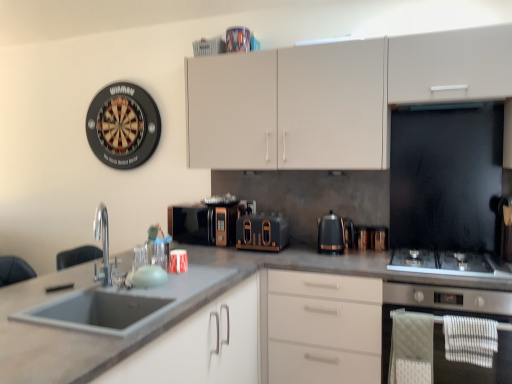
How much space does metallic silver kettle at center, which is the first appliance from right to left, occupy horizontally?

It is 3.14 inches.

Locate an element on the screen. black metallic kettle at center is located at coordinates [333, 233].

What is the approximate width of polished chrome faucet at sink left?

polished chrome faucet at sink left is 10.65 inches wide.

You are a GUI agent. You are given a task and a screenshot of the screen. Output one action in this format:
    pyautogui.click(x=<x>, y=<y>)
    Task: Click on the matte black coffee machine at center
    The image size is (512, 384).
    Given the screenshot: What is the action you would take?
    pyautogui.click(x=203, y=223)

Is gray matte countertop at center turned away from matte white cabinets at upper center, placed as the second cabinetry when sorted from left to right?

No, gray matte countertop at center is not facing the opposite direction of matte white cabinets at upper center, placed as the second cabinetry when sorted from left to right.

Consider the image. From a real-world perspective, is gray matte countertop at center positioned over matte white cabinets at upper center, arranged as the second cabinetry when ordered from the bottom, based on gravity?

Incorrect, from a real-world perspective, gray matte countertop at center is lower than matte white cabinets at upper center, arranged as the second cabinetry when ordered from the bottom.

Considering the sizes of objects gray matte countertop at center and matte white cabinets at upper center, placed as the second cabinetry when sorted from left to right, in the image provided, who is smaller, gray matte countertop at center or matte white cabinets at upper center, placed as the second cabinetry when sorted from left to right,?

With smaller size is matte white cabinets at upper center, placed as the second cabinetry when sorted from left to right.

Are gray matte countertop at center and matte white cabinets at upper center, which is counted as the 1th cabinetry, starting from the right, making contact?

No, gray matte countertop at center is not touching matte white cabinets at upper center, which is counted as the 1th cabinetry, starting from the right.

Is black metallic kettle at center located within matte black toaster at center, the 1th appliance viewed from the left?

Actually, black metallic kettle at center is outside matte black toaster at center, the 1th appliance viewed from the left.

Considering the sizes of objects matte black toaster at center, marked as the second appliance in a right-to-left arrangement, and black metallic kettle at center in the image provided, who is taller, matte black toaster at center, marked as the second appliance in a right-to-left arrangement, or black metallic kettle at center?

Standing taller between the two is black metallic kettle at center.

From a real-world perspective, who is located lower, black metallic kettle at center or matte white cabinets at upper center, which is counted as the 1th cabinetry, starting from the right?

black metallic kettle at center is physically lower.

Is the position of black metallic kettle at center more distant than that of matte white cabinets at upper center, arranged as the second cabinetry when ordered from the bottom?

Yes, it is behind matte white cabinets at upper center, arranged as the second cabinetry when ordered from the bottom.

Do you think black metallic kettle at center is within matte white cabinets at upper center, the first cabinetry viewed from the top, or outside of it?

black metallic kettle at center cannot be found inside matte white cabinets at upper center, the first cabinetry viewed from the top.

Is stainless steel gas stove at right oriented towards matte black coffee machine at center?

No, stainless steel gas stove at right is not oriented towards matte black coffee machine at center.

Is stainless steel gas stove at right directly adjacent to matte black coffee machine at center?

No, stainless steel gas stove at right is not next to matte black coffee machine at center.

From a real-world perspective, which is physically below, stainless steel gas stove at right or matte black coffee machine at center?

stainless steel gas stove at right is physically lower.

Looking at their sizes, would you say stainless steel gas stove at right is wider or thinner than matte black coffee machine at center?

In the image, stainless steel gas stove at right appears to be wider than matte black coffee machine at center.

From the picture: Does matte black coffee machine at center have a lesser width compared to stainless steel gas stove at right?

Indeed, matte black coffee machine at center has a lesser width compared to stainless steel gas stove at right.

Based on the photo, is matte black coffee machine at center positioned before stainless steel gas stove at right?

No.

Considering the relative sizes of matte black coffee machine at center and stainless steel gas stove at right in the image provided, is matte black coffee machine at center shorter than stainless steel gas stove at right?

Incorrect, the height of matte black coffee machine at center does not fall short of that of stainless steel gas stove at right.

Which is in front, point (213, 219) or point (394, 251)?

The point (394, 251) is in front.

Between point (419, 276) and point (110, 269), which one is positioned behind?

Positioned behind is point (419, 276).

Which object is further away from the camera, gray matte countertop at center or polished chrome faucet at sink left?

polished chrome faucet at sink left is further away from the camera.

What's the angular difference between gray matte countertop at center and polished chrome faucet at sink left's facing directions?

gray matte countertop at center and polished chrome faucet at sink left are facing 38.5 degrees away from each other.

How much distance is there between gray matte countertop at center and polished chrome faucet at sink left?

62.10 centimeters.

Does point (370, 234) come behind point (448, 287)?

Yes.

From the picture: Is metallic silver kettle at center, which is the first appliance from right to left, not within stainless steel oven at lower right?

That's correct, metallic silver kettle at center, which is the first appliance from right to left, is outside of stainless steel oven at lower right.

Is metallic silver kettle at center, which is the first appliance from right to left, shorter than stainless steel oven at lower right?

Correct, metallic silver kettle at center, which is the first appliance from right to left, is not as tall as stainless steel oven at lower right.

This screenshot has width=512, height=384. There is a stainless steel oven at lower right. Identify the location of the 1st appliance above it (from a real-world perspective). (379, 238).

You are a GUI agent. You are given a task and a screenshot of the screen. Output one action in this format:
    pyautogui.click(x=<x>, y=<y>)
    Task: Click on the 2nd cabinetry behind the gray matte countertop at center
    The width and height of the screenshot is (512, 384).
    Given the screenshot: What is the action you would take?
    pyautogui.click(x=332, y=97)

Locate an element on the screen. kitchen appliance on the right of the matte black toaster at center, the 1th appliance viewed from the left is located at coordinates (333, 233).

Consider the image. Based on their spatial positions, is matte black toaster at center, the 1th appliance viewed from the left, or metallic silver kettle at center, which is the first appliance from right to left, further from matte black coffee machine at center?

metallic silver kettle at center, which is the first appliance from right to left, is positioned further to the anchor matte black coffee machine at center.

From the image, which object appears to be farther from gray matte countertop at center, black metallic kettle at center or polished chrome faucet at sink left?

Based on the image, polished chrome faucet at sink left appears to be further to gray matte countertop at center.

Which object lies nearer to the anchor point gray matte countertop at center, stainless steel oven at lower right or matte black toaster at center, the 1th appliance viewed from the left?

Among the two, stainless steel oven at lower right is located nearer to gray matte countertop at center.

Considering their positions, is metallic silver kettle at center, which is the first appliance from right to left, positioned further to stainless steel oven at lower right than stainless steel gas stove at right?

metallic silver kettle at center, which is the first appliance from right to left, is positioned further to the anchor stainless steel oven at lower right.

Which object lies nearer to the anchor point matte black coffee machine at center, black metallic kettle at center or stainless steel gas stove at right?

black metallic kettle at center is positioned closer to the anchor matte black coffee machine at center.

From the image, which object appears to be nearer to metallic silver kettle at center, which is the first appliance from right to left, black metallic kettle at center or matte black toaster at center, marked as the second appliance in a right-to-left arrangement?

Among the two, black metallic kettle at center is located nearer to metallic silver kettle at center, which is the first appliance from right to left.

Looking at the image, which one is located further to polished chrome faucet at sink left, stainless steel oven at lower right or matte white cabinets at upper center, placed as the second cabinetry when sorted from left to right?

The object further to polished chrome faucet at sink left is stainless steel oven at lower right.

Based on their spatial positions, is black metallic kettle at center or gray matte countertop at center further from matte gray sink at lower left, acting as the 2th cabinetry starting from the right?

Among the two, black metallic kettle at center is located further to matte gray sink at lower left, acting as the 2th cabinetry starting from the right.

I want to click on cabinetry between matte gray sink at lower left, acting as the 2th cabinetry starting from the right, and stainless steel gas stove at right, so click(332, 97).

This screenshot has width=512, height=384. In order to click on gas stove positioned between gray matte countertop at center and metallic silver kettle at center, which is the first appliance from right to left, from near to far in this screenshot , I will do `click(448, 263)`.

Identify the location of appliance situated between matte black coffee machine at center and black metallic kettle at center from left to right. (262, 232).

You are a GUI agent. You are given a task and a screenshot of the screen. Output one action in this format:
    pyautogui.click(x=<x>, y=<y>)
    Task: Click on the cabinetry between gray matte countertop at center and polished chrome faucet at sink left along the z-axis
    Image resolution: width=512 pixels, height=384 pixels.
    Given the screenshot: What is the action you would take?
    pyautogui.click(x=202, y=345)